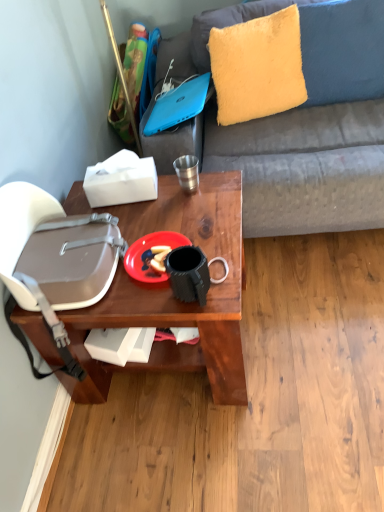
Based on the photo, what is the approximate width of matte gray handbag at left?

The width of matte gray handbag at left is 11.43 inches.

Image resolution: width=384 pixels, height=512 pixels. What are the coordinates of `wooden table at center` in the screenshot? It's located at (x=172, y=295).

The width and height of the screenshot is (384, 512). I want to click on blue matte laptop at upper center, so click(179, 104).

Which object is wider, plastic matte plate at center or wooden table at center?

wooden table at center.

Considering the relative positions of plastic matte plate at center and wooden table at center in the image provided, is plastic matte plate at center to the right of wooden table at center from the viewer's perspective?

Indeed, plastic matte plate at center is positioned on the right side of wooden table at center.

Does plastic matte plate at center contain wooden table at center?

That's incorrect, wooden table at center is not inside plastic matte plate at center.

Is plastic matte plate at center looking in the opposite direction of wooden table at center?

No, plastic matte plate at center is not facing away from wooden table at center.

Where is `pillow above the wooden table at center (from the image's perspective)`? The height and width of the screenshot is (512, 384). pillow above the wooden table at center (from the image's perspective) is located at coordinates (257, 67).

From the picture: Is wooden table at center to the right of fuzzy yellow pillow at upper right from the viewer's perspective?

No.

Which is in front, point (225, 333) or point (251, 90)?

Point (225, 333)

Who is more distant, wooden table at center or fuzzy yellow pillow at upper right?

fuzzy yellow pillow at upper right is further away from the camera.

Is fuzzy yellow pillow at upper right at the right side of blue matte laptop at upper center?

Yes, fuzzy yellow pillow at upper right is to the right of blue matte laptop at upper center.

Consider the image. Is fuzzy yellow pillow at upper right taller or shorter than blue matte laptop at upper center?

In the image, fuzzy yellow pillow at upper right appears to be taller than blue matte laptop at upper center.

Which object is thinner, fuzzy yellow pillow at upper right or blue matte laptop at upper center?

With smaller width is fuzzy yellow pillow at upper right.

Measure the distance from matte gray handbag at left to wooden table at center.

They are 6.35 inches apart.

From the picture: From the image's perspective, is matte gray handbag at left located above or below wooden table at center?

Based on their image positions, matte gray handbag at left is located above wooden table at center.

From a real-world perspective, between matte gray handbag at left and wooden table at center, who is vertically higher?

matte gray handbag at left is physically above.

From the picture: From a real-world perspective, does matte gray handbag at left stand above metallic silver cup at center?

No.

How far apart are matte gray handbag at left and metallic silver cup at center?

matte gray handbag at left is 18.52 inches from metallic silver cup at center.

Considering the sizes of objects matte gray handbag at left and metallic silver cup at center in the image provided, who is wider, matte gray handbag at left or metallic silver cup at center?

Wider between the two is matte gray handbag at left.

In the scene shown: From the image's perspective, is wooden table at center located beneath plastic matte plate at center?

Yes, from the image's perspective, wooden table at center is below plastic matte plate at center.

Does wooden table at center appear on the right side of plastic matte plate at center?

Incorrect, wooden table at center is not on the right side of plastic matte plate at center.

Where is `plate located on the right of wooden table at center`? This screenshot has width=384, height=512. plate located on the right of wooden table at center is located at coordinates (150, 255).

Can you tell me how much wooden table at center and metallic silver cup at center differ in facing direction?

The facing directions of wooden table at center and metallic silver cup at center are 1.82 degrees apart.

Does wooden table at center turn towards metallic silver cup at center?

No, wooden table at center does not turn towards metallic silver cup at center.

Based on the photo, from the image's perspective, is wooden table at center on metallic silver cup at center?

No, from the image's perspective, wooden table at center is not on top of metallic silver cup at center.

From a real-world perspective, is wooden table at center located higher than metallic silver cup at center?

Incorrect, from a real-world perspective, wooden table at center is lower than metallic silver cup at center.

The width and height of the screenshot is (384, 512). I want to click on plate that appears above the wooden table at center (from the image's perspective), so click(x=150, y=255).

The image size is (384, 512). In order to click on pillow to the right of wooden table at center in this screenshot , I will do `click(257, 67)`.

Considering their positions, is blue matte laptop at upper center positioned closer to wooden table at center than fuzzy yellow pillow at upper right?

The object closer to wooden table at center is blue matte laptop at upper center.

In the scene shown: Which object lies further to the anchor point fuzzy yellow pillow at upper right, matte gray handbag at left or plastic matte plate at center?

matte gray handbag at left.

From the image, which object appears to be nearer to wooden table at center, fuzzy yellow pillow at upper right or matte gray handbag at left?

Based on the image, matte gray handbag at left appears to be nearer to wooden table at center.

From the image, which object appears to be farther from matte gray handbag at left, blue matte laptop at upper center or metallic silver cup at center?

blue matte laptop at upper center is positioned further to the anchor matte gray handbag at left.

Which object lies further to the anchor point metallic silver cup at center, blue matte laptop at upper center or wooden table at center?

wooden table at center lies further to metallic silver cup at center than the other object.

From the image, which object appears to be nearer to blue matte laptop at upper center, fuzzy yellow pillow at upper right or metallic silver cup at center?

The object closer to blue matte laptop at upper center is fuzzy yellow pillow at upper right.

Looking at the image, which one is located further to metallic silver cup at center, blue matte laptop at upper center or matte gray handbag at left?

matte gray handbag at left is positioned further to the anchor metallic silver cup at center.

Based on their spatial positions, is plastic matte plate at center or fuzzy yellow pillow at upper right closer to matte gray handbag at left?

Based on the image, plastic matte plate at center appears to be nearer to matte gray handbag at left.

Identify the location of plate positioned between matte gray handbag at left and metallic silver cup at center from near to far. (150, 255).

You are a GUI agent. You are given a task and a screenshot of the screen. Output one action in this format:
    pyautogui.click(x=<x>, y=<y>)
    Task: Click on the handbag between fuzzy yellow pillow at upper right and wooden table at center vertically
    
    Given the screenshot: What is the action you would take?
    pyautogui.click(x=54, y=259)

Find the location of a particular element. This screenshot has height=512, width=384. coffee cup that lies between fuzzy yellow pillow at upper right and matte gray handbag at left from top to bottom is located at coordinates (187, 172).

Locate an element on the screen. Image resolution: width=384 pixels, height=512 pixels. coffee cup that lies between blue matte laptop at upper center and matte gray handbag at left from top to bottom is located at coordinates (187, 172).